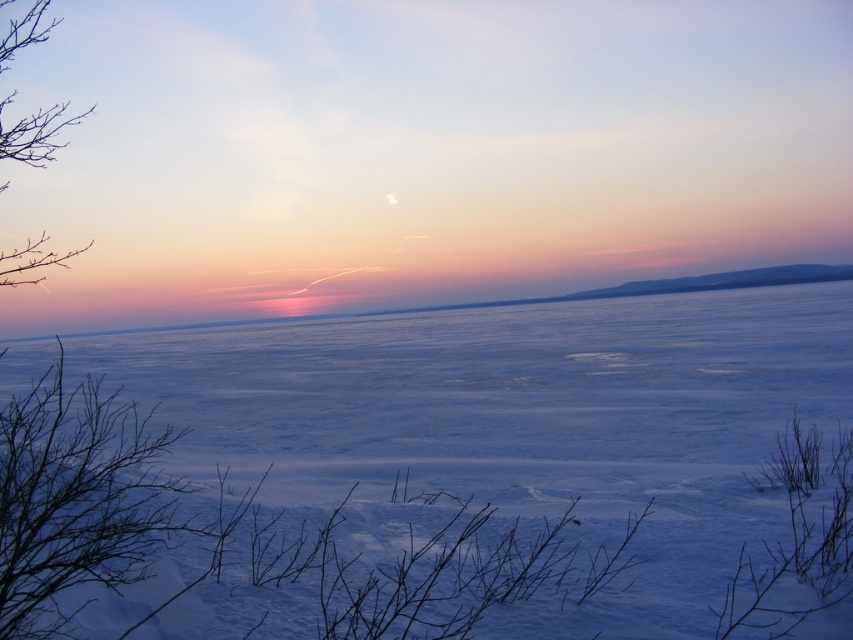
Question: Does white ice at center appear under bare branches at left?

Choices:
 (A) no
 (B) yes

Answer: (B)

Question: Among these objects, which one is nearest to the camera?

Choices:
 (A) white ice at center
 (B) bare branches at left

Answer: (B)

Question: Among these points, which one is farthest from the camera?

Choices:
 (A) [88, 244]
 (B) [252, 397]

Answer: (B)

Question: Is white ice at center thinner than bare branches at left?

Choices:
 (A) yes
 (B) no

Answer: (A)

Question: Observing the image, what is the correct spatial positioning of white ice at center in reference to bare branches at left?

Choices:
 (A) below
 (B) above

Answer: (A)